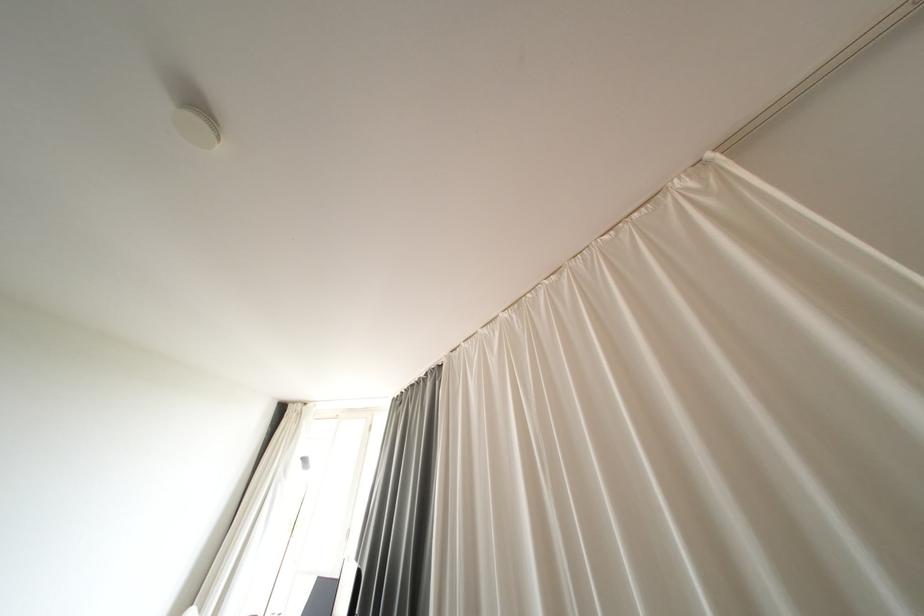
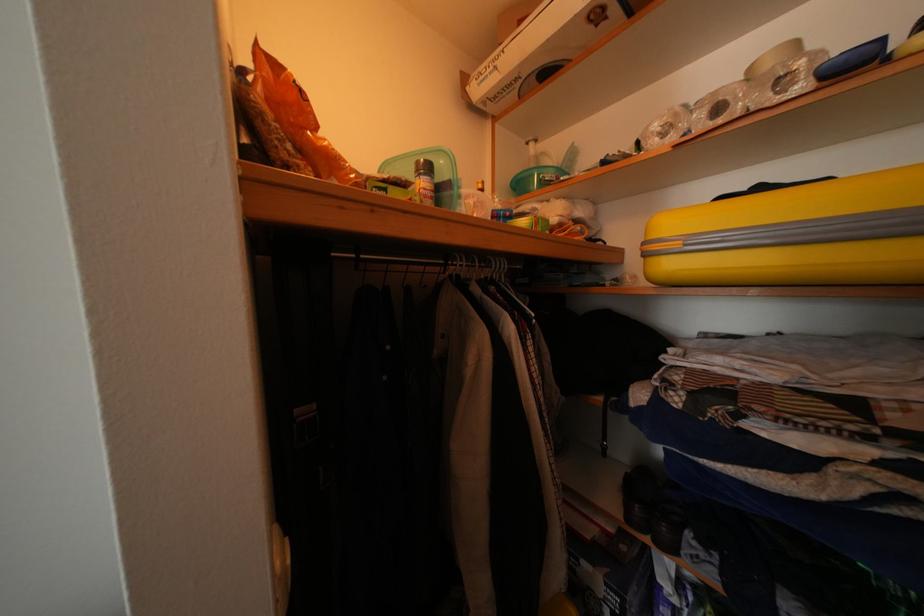
Question: The camera is either moving clockwise (left) or counter-clockwise (right) around the object. The first image is from the beginning of the video and the second image is from the end. Is the camera moving left or right when shooting the video?

Choices:
 (A) Left
 (B) Right

Answer: (A)